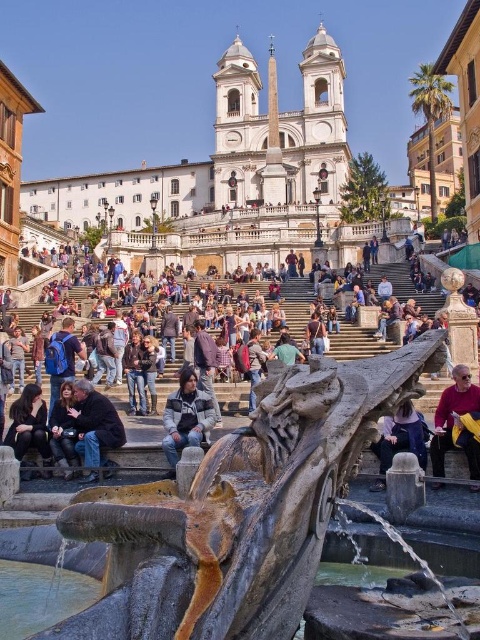
You are a photographer trying to capture a wide shot of the rustic stone fountain at center and the dark gray jacket at center in the Spanish Steps scene. Given that your camera can only focus on objects within a 2 meter width, will both objects fit in the frame?

Answer: The rustic stone fountain at center is wider than the dark gray jacket at center. However, since the camera can focus on objects within a 2 meter width, both objects should fit as long as their combined width does not exceed 2 meters. But since the fountain is wider, it depends on their exact widths. Unfortunately, the exact measurements aren

You are a tourist visiting the Spanish Steps and want to take a photo that includes both the rustic stone fountain at center and the dark gray stone jacket at lower left. Which object should you position closer to the camera to ensure both fit in the frame?

The rustic stone fountain at center is bigger than the dark gray stone jacket at lower left, so you should position the dark gray stone jacket at lower left closer to the camera to ensure both fit in the frame.